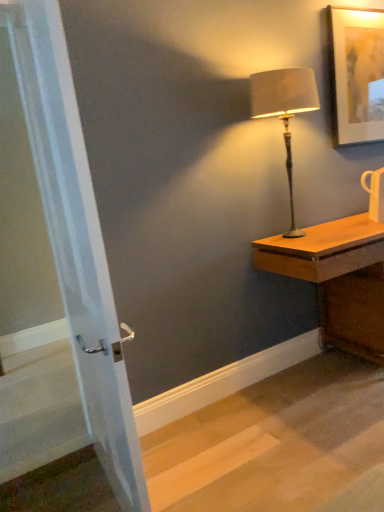
The image size is (384, 512). What are the coordinates of `free spot in front of satin beige lampshade at right` in the screenshot? It's located at (320, 242).